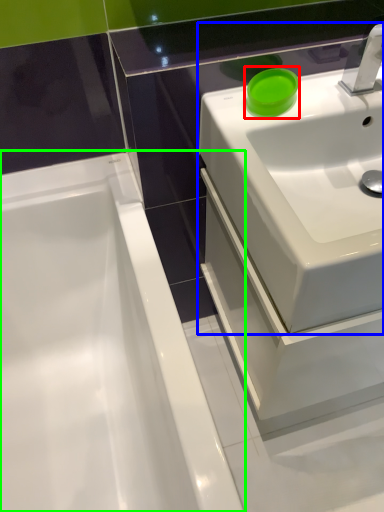
Question: Considering the real-world distances, which object is closest to teal (highlighted by a red box)? sink (highlighted by a blue box) or bathtub (highlighted by a green box).

Choices:
 (A) sink
 (B) bathtub

Answer: (A)